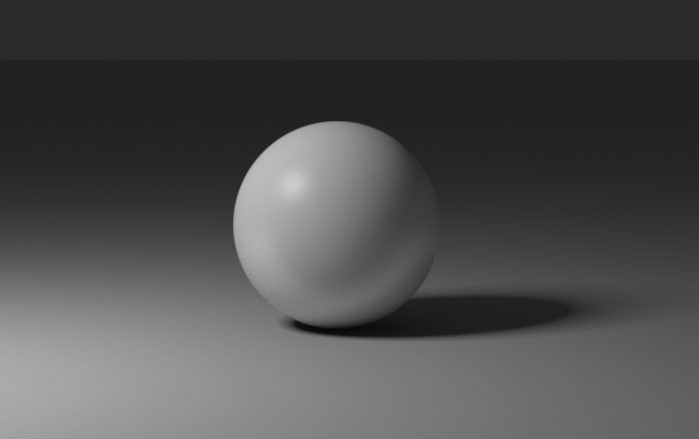
In order to click on counter in this screenshot , I will do `click(138, 378)`, `click(329, 367)`, `click(540, 378)`.